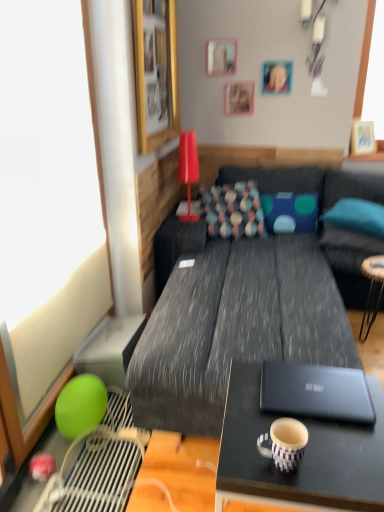
Find the location of a particular element. The image size is (384, 512). vacant space in between porcelain textured mug at center and black matte laptop at center is located at coordinates (323, 437).